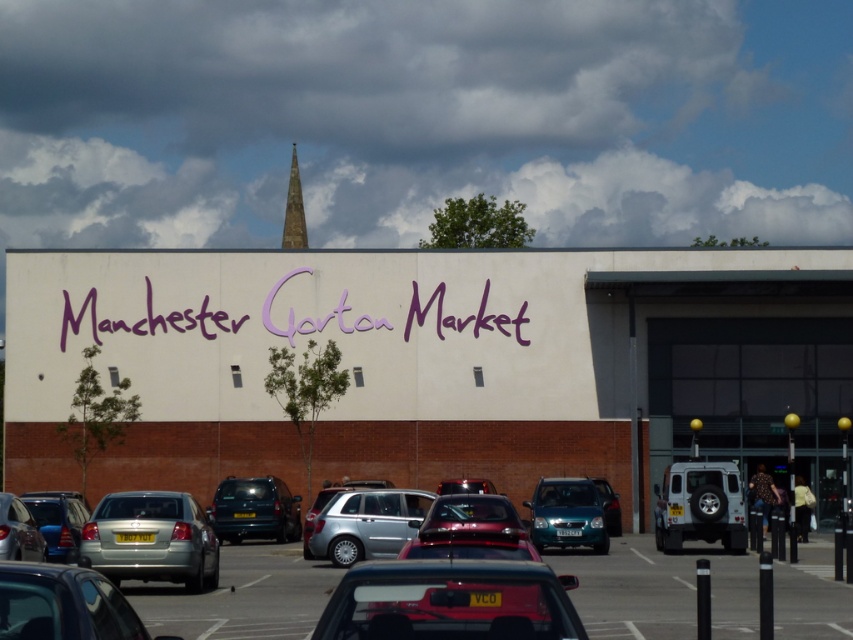
Question: Which of the following is the farthest from the observer?

Choices:
 (A) (196, 566)
 (B) (289, 173)
 (C) (28, 566)
 (D) (212, 502)

Answer: (B)

Question: Which of these objects is positioned farthest from the teal matte van at center?

Choices:
 (A) silver metallic car at lower left
 (B) teal glossy hatchback at center

Answer: (A)

Question: Is silver metallic suv at lower right to the left of matte silver car at lower left from the viewer's perspective?

Choices:
 (A) no
 (B) yes

Answer: (A)

Question: Is teal glossy hatchback at center wider than matte silver car at lower left?

Choices:
 (A) yes
 (B) no

Answer: (B)

Question: Which point is closer to the camera?

Choices:
 (A) metallic red car at center
 (B) purple painted sign at center

Answer: (A)

Question: Can you confirm if metallic silver car at center is positioned below teal matte van at center?

Choices:
 (A) no
 (B) yes

Answer: (A)